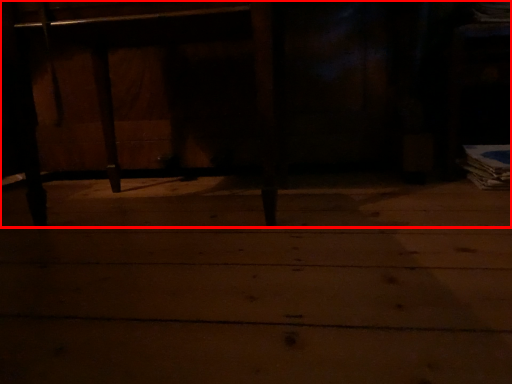
Question: From the image's perspective, where is furniture (annotated by the red box) located in relation to concrete in the image?

Choices:
 (A) below
 (B) above

Answer: (B)